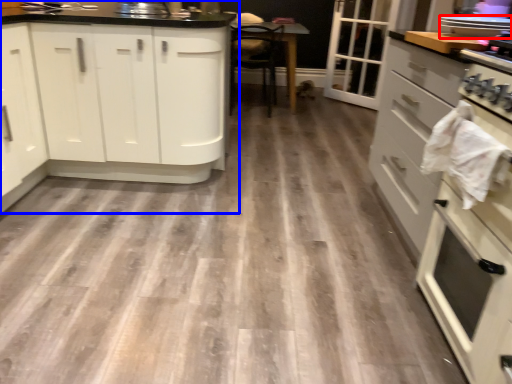
Question: Which object is closer to the camera taking this photo, kitchen appliance (highlighted by a red box) or cabinetry (highlighted by a blue box)?

Choices:
 (A) kitchen appliance
 (B) cabinetry

Answer: (A)